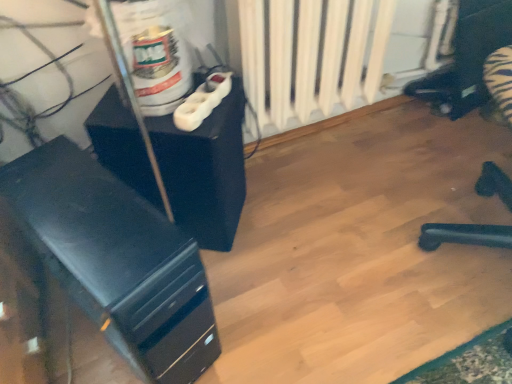
Question: From the image's perspective, is white matte radiator at center above or below black matte computer tower at left, which ranks as the 1th furniture in bottom-to-top order?

Choices:
 (A) below
 (B) above

Answer: (B)

Question: Is white matte radiator at center inside the boundaries of black matte computer tower at left, which is counted as the 2th furniture, starting from the top, or outside?

Choices:
 (A) outside
 (B) inside

Answer: (A)

Question: Which is farther from the white matte radiator at center?

Choices:
 (A) white plastic plug at upper center
 (B) black matte computer tower at left, which ranks as the 1th furniture in bottom-to-top order
 (C) matte black cabinet at center-left, which appears as the second furniture when ordered from the bottom

Answer: (B)

Question: Based on their relative distances, which object is nearer to the matte black cabinet at center-left, which appears as the second furniture when ordered from the bottom?

Choices:
 (A) white matte radiator at center
 (B) white plastic plug at upper center
 (C) black matte computer tower at left, which ranks as the 1th furniture in bottom-to-top order

Answer: (B)